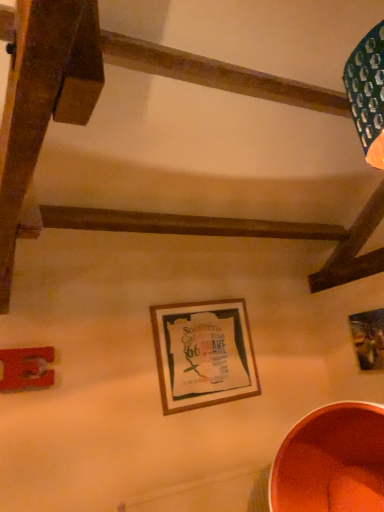
Question: Is wooden picture frame at upper right, placed as the 1th picture frame when sorted from right to left, inside the boundaries of metallic copper basin at lower right, or outside?

Choices:
 (A) outside
 (B) inside

Answer: (A)

Question: In the image, is wooden picture frame at upper right, which ranks as the third picture frame in left-to-right order, positioned in front of or behind metallic copper basin at lower right?

Choices:
 (A) front
 (B) behind

Answer: (B)

Question: Based on their relative distances, which object is farther from the metallic copper basin at lower right?

Choices:
 (A) wooden picture frame at upper right, placed as the 1th picture frame when sorted from right to left
 (B) wooden picture frame at center, which appears as the second picture frame when viewed from the right
 (C) metallic silver picture frame at lower left, which is the third picture frame in right-to-left order

Answer: (C)

Question: Which is nearer to the wooden picture frame at center, which is the 2th picture frame from left to right?

Choices:
 (A) metallic copper basin at lower right
 (B) metallic silver picture frame at lower left, which is the third picture frame in right-to-left order
 (C) wooden picture frame at upper right, which ranks as the third picture frame in left-to-right order

Answer: (A)